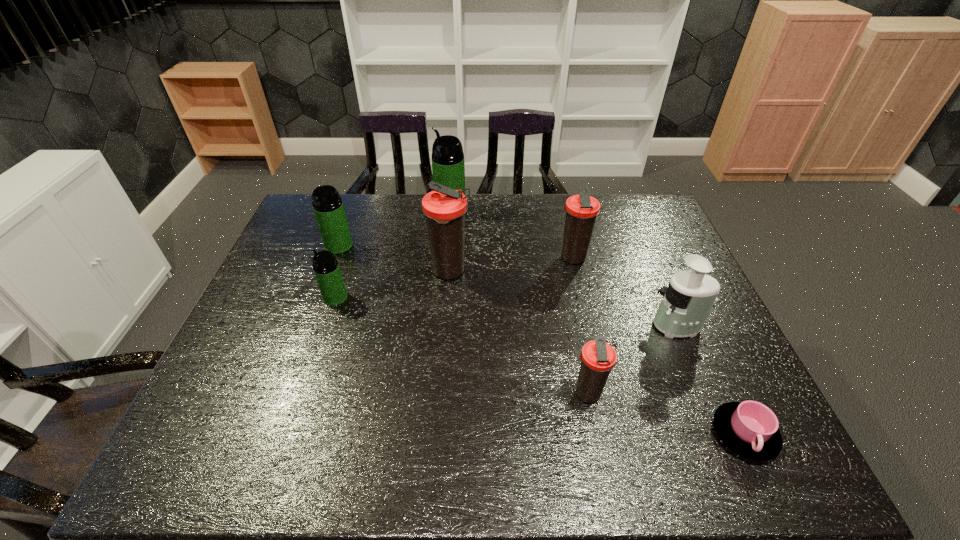
Identify which green thermos bottle is the nearest to the pink cup. Please provide its 2D coordinates. Your answer should be formatted as a tuple, i.e. [(x, y)], where the tuple contains the x and y coordinates of a point satisfying the conditions above.

[(448, 168)]

Identify which green thermos bottle is the third nearest to the juicer. Please provide its 2D coordinates. Your answer should be formatted as a tuple, i.e. [(x, y)], where the tuple contains the x and y coordinates of a point satisfying the conditions above.

[(328, 207)]

This screenshot has width=960, height=540. I want to click on free spot that satisfies the following two spatial constraints: 1. on the back side of the smallest brown thermos bottle; 2. on the left side of the second smallest brown thermos bottle, so click(559, 258).

Locate an element on the screen. This screenshot has width=960, height=540. vacant space that satisfies the following two spatial constraints: 1. from the spout of the nearest brown thermos bottle; 2. on the left side of the smallest green thermos bottle is located at coordinates (303, 394).

The width and height of the screenshot is (960, 540). I want to click on free space that satisfies the following two spatial constraints: 1. on the back side of the biggest brown thermos bottle; 2. on the right side of the second smallest brown thermos bottle, so click(451, 258).

Locate an element on the screen. This screenshot has width=960, height=540. free point that satisfies the following two spatial constraints: 1. from the spout of the farthest green thermos bottle; 2. on the right side of the leftmost brown thermos bottle is located at coordinates (445, 272).

Locate an element on the screen. This screenshot has width=960, height=540. vacant space that satisfies the following two spatial constraints: 1. from the spout of the rightmost green thermos bottle; 2. on the right side of the smallest brown thermos bottle is located at coordinates (435, 394).

The height and width of the screenshot is (540, 960). Identify the location of vacant region that satisfies the following two spatial constraints: 1. from the spout of the second biggest brown thermos bottle; 2. on the right side of the farthest object. (446, 258).